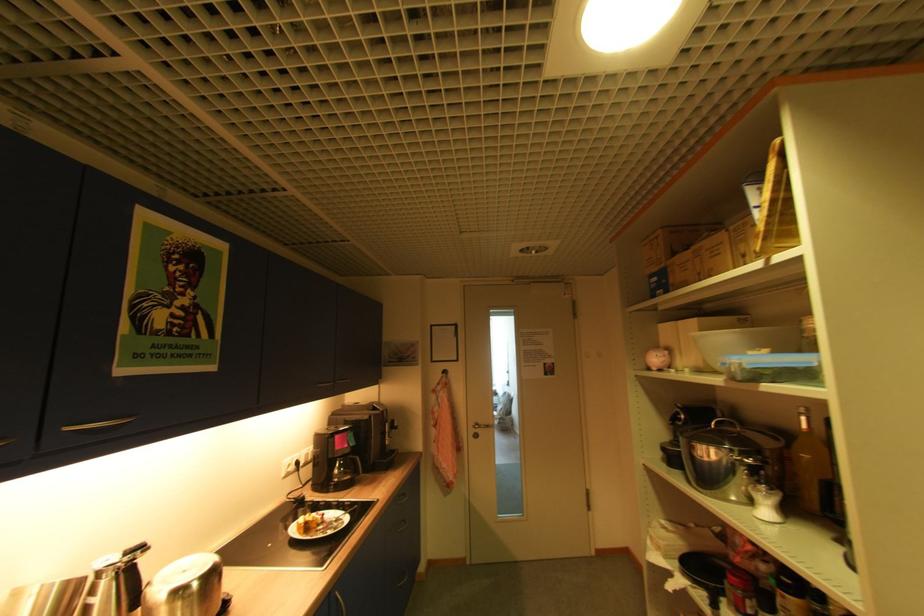
The height and width of the screenshot is (616, 924). I want to click on silver lidded container, so click(x=186, y=588).